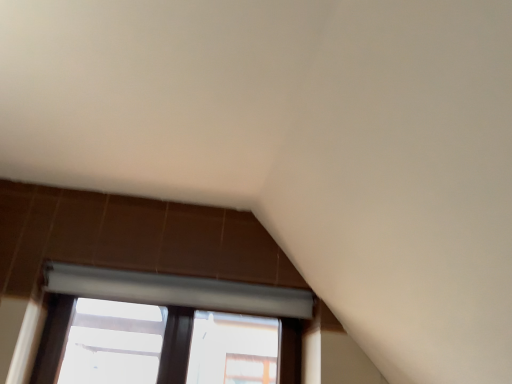
Based on the photo, what is the approximate height of transparent glass window at lower center?

38.95 centimeters.

This screenshot has height=384, width=512. Describe the element at coordinates (177, 291) in the screenshot. I see `transparent glass window at lower center` at that location.

Image resolution: width=512 pixels, height=384 pixels. Find the location of `transparent glass window at lower center`. transparent glass window at lower center is located at coordinates (177, 291).

Find the location of a particular element. The height and width of the screenshot is (384, 512). transparent glass window at lower center is located at coordinates (177, 291).